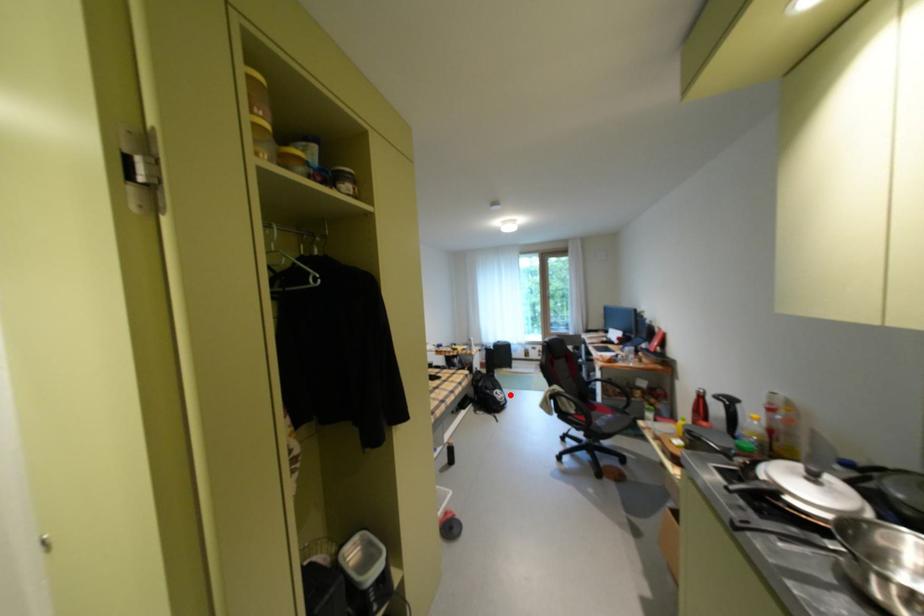
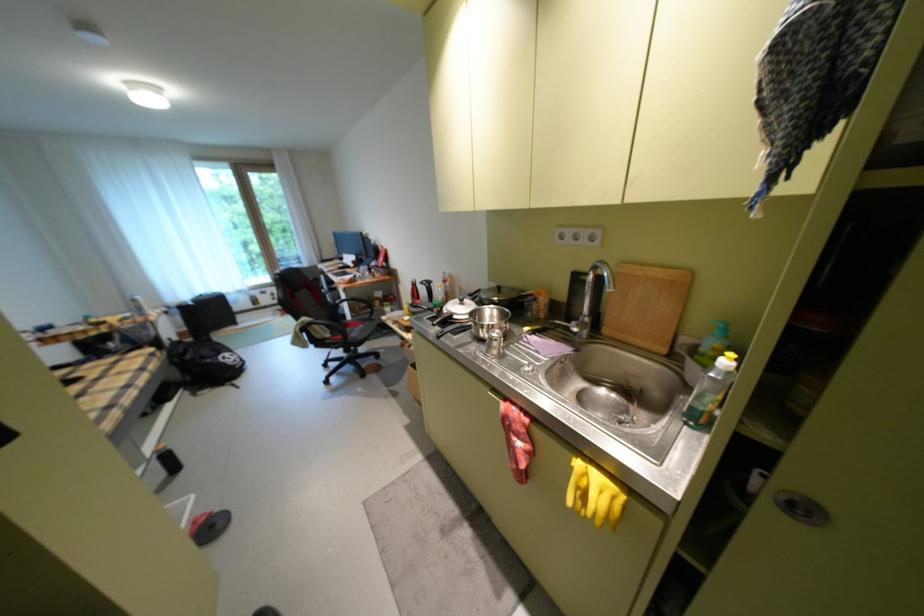
Where in the second image is the point corresponding to the highlighted location from the first image?

(239, 358)